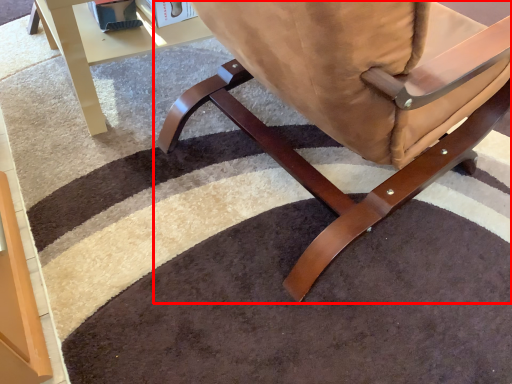
Question: From the image's perspective, where is chair (annotated by the red box) located in relation to table in the image?

Choices:
 (A) above
 (B) below

Answer: (B)